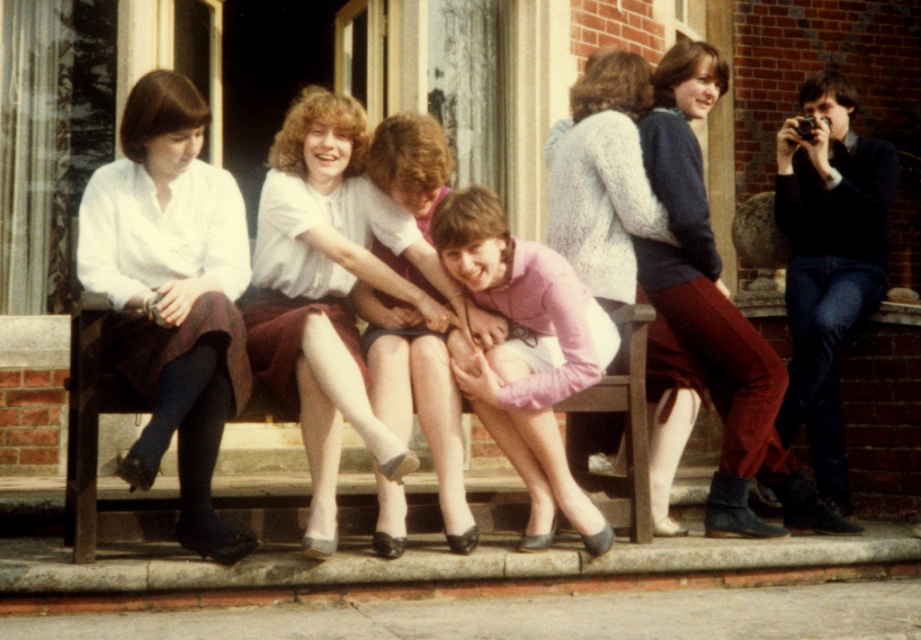
Looking at this image, you are standing in front of the bench and want to place a small plant between the two points on the bench. Which point should you place it closer to so that it appears closer to you? The two points are point (740, 422) and point (71, 324).

You should place the plant closer to point (740, 422) because it is closer to you than point (71, 324), making it appear nearer.

You are an observer standing in front of the wooden bench. You notice the velvet maroon pants at center and the matte white blouse at center. Which one is positioned higher on the person?

The velvet maroon pants at center is located above the matte white blouse at center, so the velvet maroon pants at center is positioned higher on the person.

You are a photographer trying to capture a group photo of the people on the wooden bench. Since the matte white blouse at left and the white sheer tights at center are both white, you want to ensure they are distinguishable in the photo. Which one should you focus on to ensure it stands out more due to its size?

The matte white blouse at left is much taller than the white sheer tights at center, so focusing on the matte white blouse at left will make it stand out more due to its larger size.